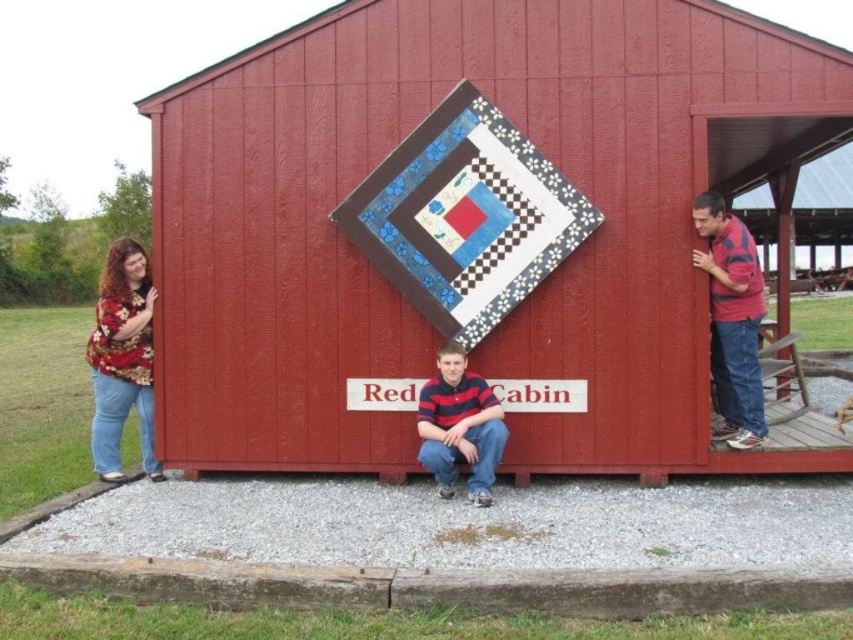
Based on the photo, who is taller, quilted fabric quilt at center or striped polo shirt at center?

With more height is quilted fabric quilt at center.

Describe the element at coordinates (465, 216) in the screenshot. I see `quilted fabric quilt at center` at that location.

The height and width of the screenshot is (640, 853). I want to click on quilted fabric quilt at center, so click(465, 216).

Is point (316, 310) in front of point (500, 253)?

No, it is not.

Does smooth wooden barn at center appear over quilted fabric quilt at center?

No, smooth wooden barn at center is not above quilted fabric quilt at center.

Find the location of a particular element. The height and width of the screenshot is (640, 853). smooth wooden barn at center is located at coordinates (410, 269).

The height and width of the screenshot is (640, 853). I want to click on smooth wooden barn at center, so click(410, 269).

Between striped cotton shirt at right and striped polo shirt at center, which one is positioned higher?

striped cotton shirt at right is higher up.

How far apart are striped cotton shirt at right and striped polo shirt at center?

striped cotton shirt at right and striped polo shirt at center are 1.91 meters apart.

The width and height of the screenshot is (853, 640). Find the location of `striped cotton shirt at right`. striped cotton shirt at right is located at coordinates (732, 320).

Locate an element on the screen. Image resolution: width=853 pixels, height=640 pixels. striped cotton shirt at right is located at coordinates (732, 320).